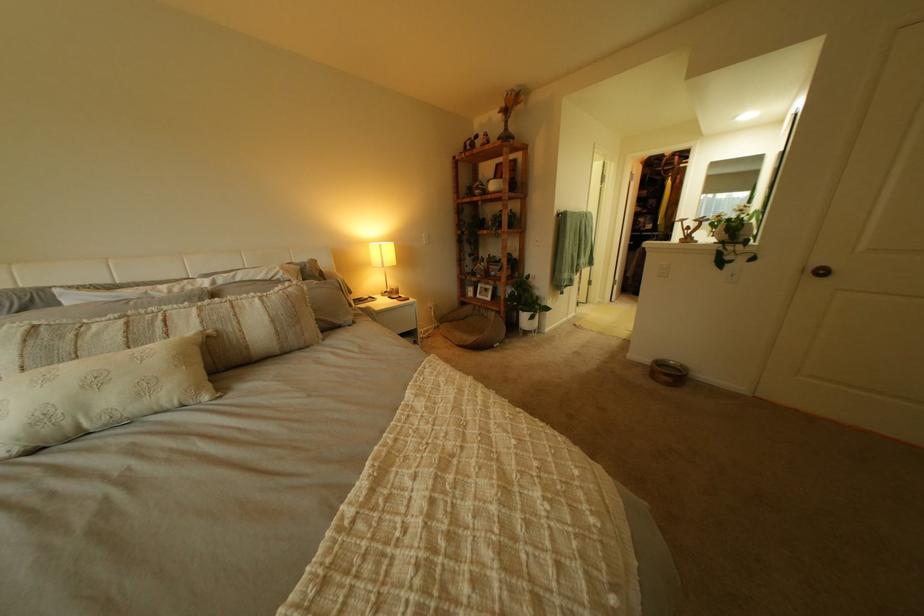
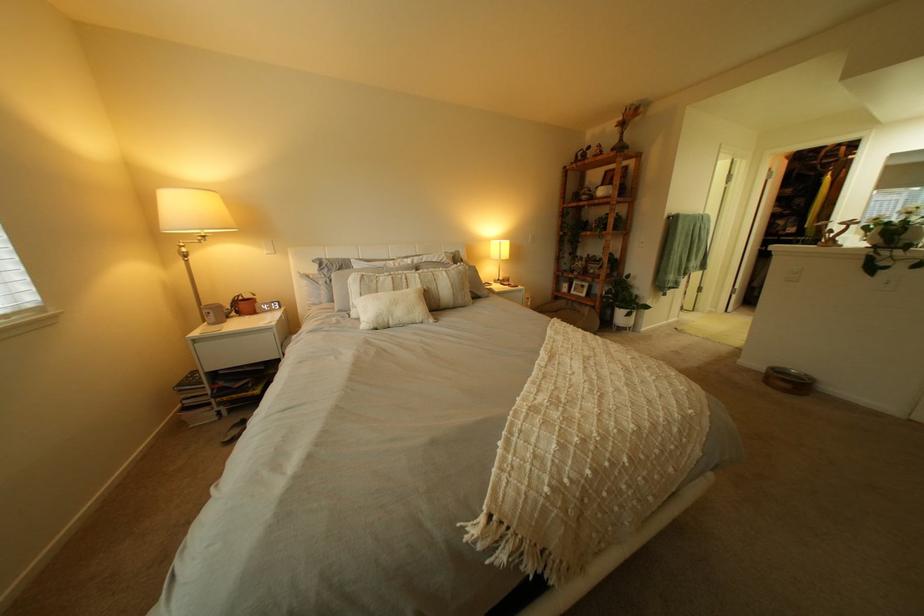
The point at (80,424) is marked in the first image. Where is the corresponding point in the second image?

(400, 320)